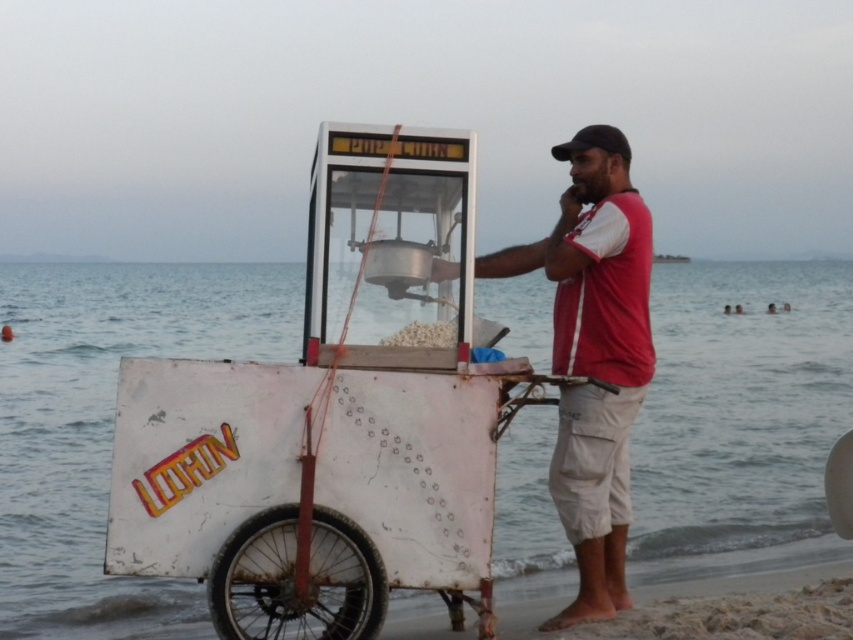
You are standing at the beach and want to walk from the popcorn cart to the ocean. There are two points marked on the sand. The first point is at coordinates point (x=207, y=380) and the second point is at point (x=645, y=221). Which point should you step on first to reach the ocean?

You should step on point (x=207, y=380) first because it is in front of point (x=645, y=221), meaning it is closer to the ocean.